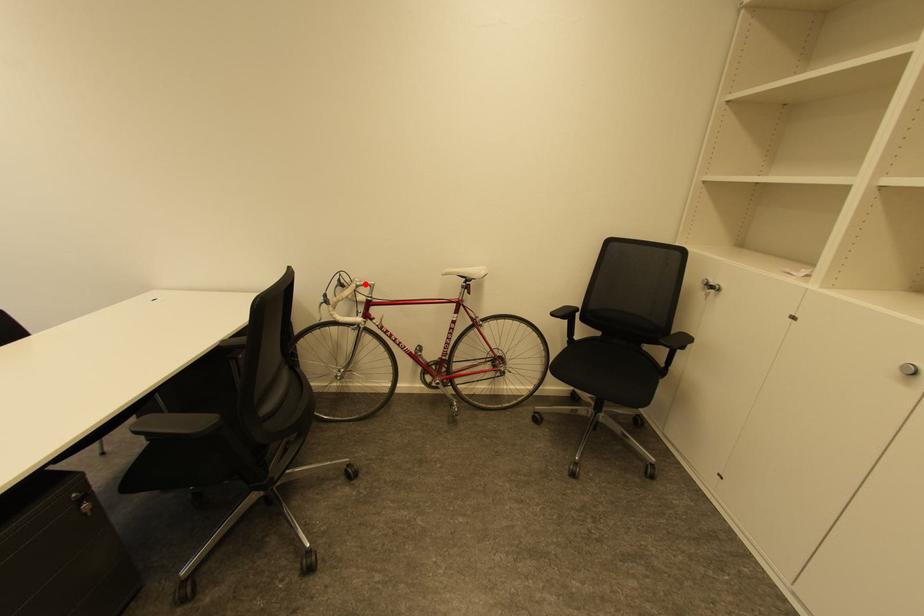
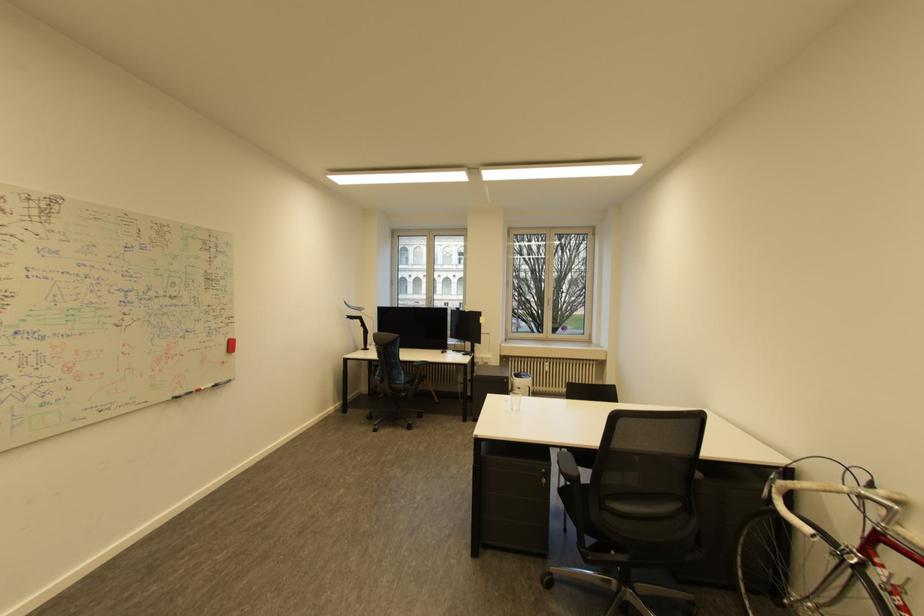
The point at the highlighted location is marked in the first image. Where is the corresponding point in the second image?

(869, 492)